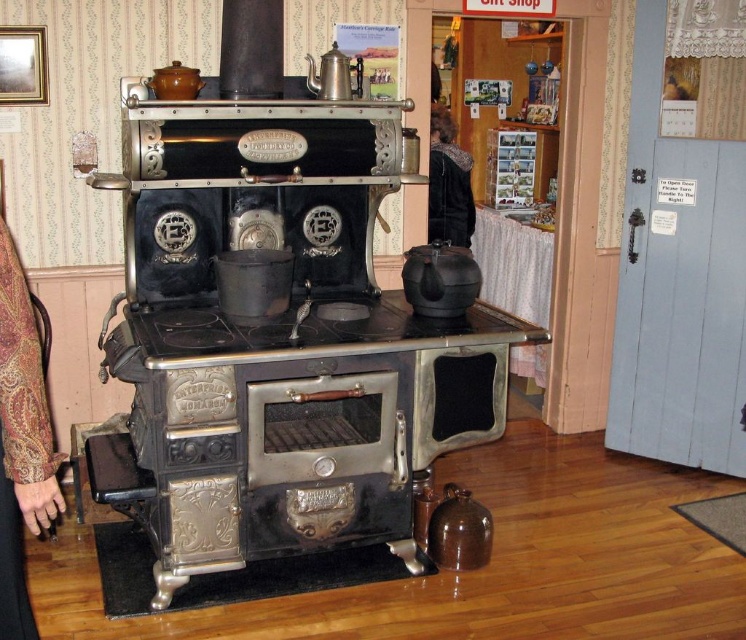
Question: From the image, what is the correct spatial relationship of black cast iron stove at center in relation to velvet black coat at center?

Choices:
 (A) left
 (B) right

Answer: (A)

Question: Which point is farther from the camera taking this photo?

Choices:
 (A) (354, 436)
 (B) (466, 205)

Answer: (B)

Question: Can you confirm if black cast iron stove at center is thinner than velvet black coat at center?

Choices:
 (A) yes
 (B) no

Answer: (B)

Question: Does black cast iron stove at center have a greater width compared to velvet black coat at center?

Choices:
 (A) yes
 (B) no

Answer: (A)

Question: Which object appears farthest from the camera in this image?

Choices:
 (A) velvet black coat at center
 (B) black cast iron stove at center

Answer: (A)